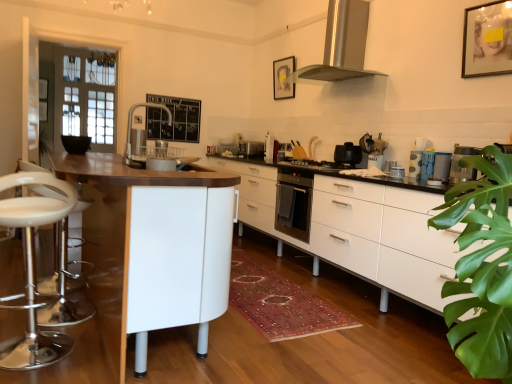
Locate an element on the screen. empty space that is to the right of white matte table at center is located at coordinates [x=286, y=312].